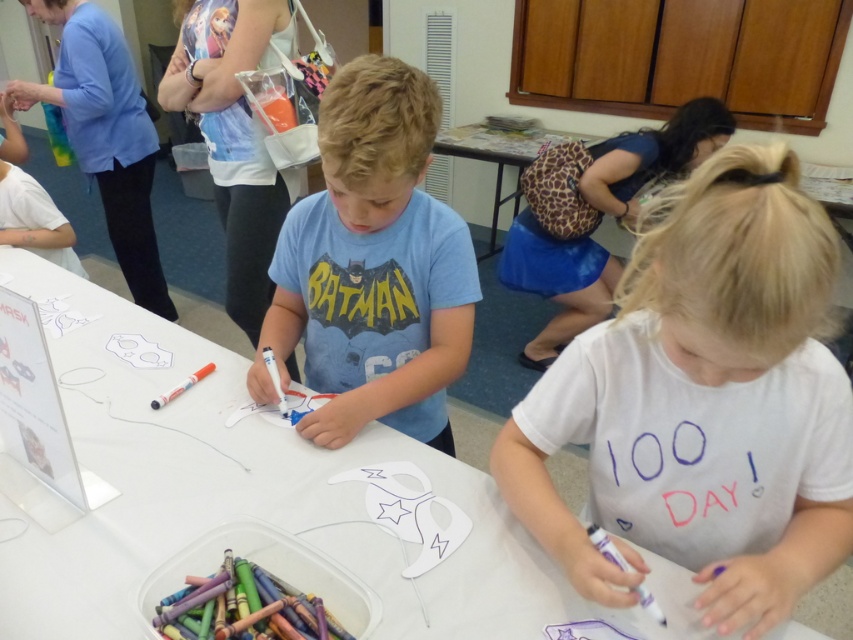
Question: Observing the image, what is the correct spatial positioning of white fabric skirt at upper center in reference to leopard print fabric at upper center?

Choices:
 (A) right
 (B) left

Answer: (A)

Question: Which point is farther to the camera?

Choices:
 (A) (532, 132)
 (B) (410, 292)

Answer: (A)

Question: Is matte blue t-shirt at center wider than leopard print fabric at upper center?

Choices:
 (A) yes
 (B) no

Answer: (B)

Question: Is multicolored wax crayon at lower left behind orange matte marker at lower left?

Choices:
 (A) no
 (B) yes

Answer: (A)

Question: Among these objects, which one is farthest from the camera?

Choices:
 (A) multicolored wax crayon at lower left
 (B) matte blue t-shirt at center
 (C) white fabric skirt at upper center

Answer: (C)

Question: Estimate the real-world distances between objects in this image. Which object is farther from the orange matte marker at lower left?

Choices:
 (A) multicolored wax crayon at lower left
 (B) white cotton shirt at lower right
 (C) white fabric skirt at upper center

Answer: (C)